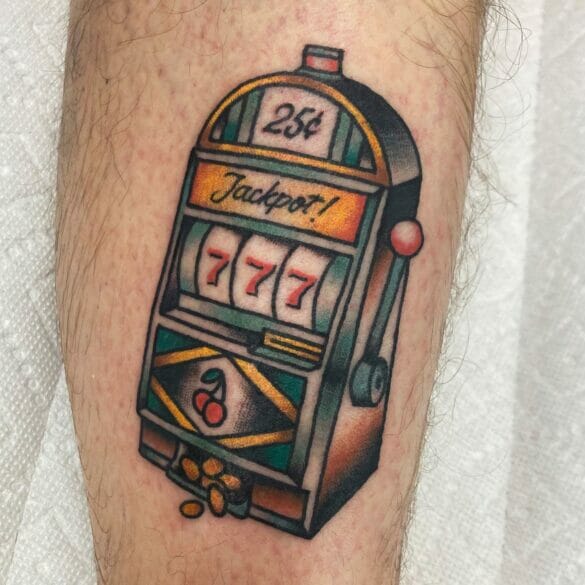
Where is `light`? light is located at coordinates (319, 67).